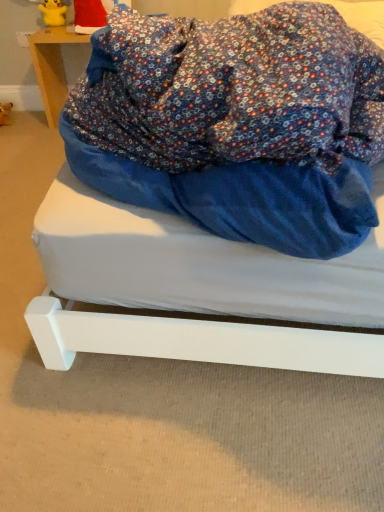
Question: Considering the positions of white matte bed at center and yellow rubber figurine at upper left in the image, is white matte bed at center wider or thinner than yellow rubber figurine at upper left?

Choices:
 (A) wide
 (B) thin

Answer: (A)

Question: From their relative heights in the image, would you say white matte bed at center is taller or shorter than yellow rubber figurine at upper left?

Choices:
 (A) tall
 (B) short

Answer: (B)

Question: Which of these objects is positioned closest to the yellow rubber figurine at upper left?

Choices:
 (A) santa hat at upper left
 (B) white matte bed at center
 (C) wooden table at upper left

Answer: (A)

Question: Based on their relative distances, which object is farther from the yellow rubber figurine at upper left?

Choices:
 (A) wooden table at upper left
 (B) white matte bed at center
 (C) santa hat at upper left

Answer: (B)